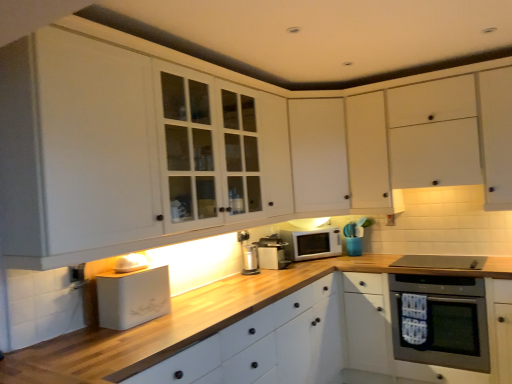
Question: From a real-world perspective, is satin silver toaster at center, which is the 1th appliance from back to front, positioned over white glossy microwave at center based on gravity?

Choices:
 (A) yes
 (B) no

Answer: (B)

Question: From the image's perspective, is satin silver toaster at center, the first appliance in the right-to-left sequence, above white glossy microwave at center?

Choices:
 (A) yes
 (B) no

Answer: (B)

Question: From a real-world perspective, is satin silver toaster at center, the first appliance in the right-to-left sequence, under white glossy microwave at center?

Choices:
 (A) yes
 (B) no

Answer: (A)

Question: Is satin silver toaster at center, the 3th appliance when ordered from left to right, surrounding white glossy microwave at center?

Choices:
 (A) yes
 (B) no

Answer: (B)

Question: Does satin silver toaster at center, the first appliance in the right-to-left sequence, have a larger size compared to white glossy microwave at center?

Choices:
 (A) no
 (B) yes

Answer: (A)

Question: Based on their sizes in the image, would you say white matte cabinet at upper center, the 1th cabinetry viewed from the back, is bigger or smaller than white matte drawer at lower center?

Choices:
 (A) small
 (B) big

Answer: (A)

Question: Considering the positions of white matte cabinet at upper center, the third cabinetry in the front-to-back sequence, and white matte drawer at lower center in the image, is white matte cabinet at upper center, the third cabinetry in the front-to-back sequence, wider or thinner than white matte drawer at lower center?

Choices:
 (A) thin
 (B) wide

Answer: (A)

Question: In the image, is white matte cabinet at upper center, the third cabinetry in the front-to-back sequence, positioned in front of or behind white matte drawer at lower center?

Choices:
 (A) front
 (B) behind

Answer: (B)

Question: In the image, is white matte cabinet at upper center, the 1th cabinetry viewed from the back, on the left side or the right side of white matte drawer at lower center?

Choices:
 (A) right
 (B) left

Answer: (A)

Question: In terms of size, does white matte bread bin at lower left, the third appliance from the right, appear bigger or smaller than matte gray oven at lower right?

Choices:
 (A) small
 (B) big

Answer: (B)

Question: Relative to matte gray oven at lower right, is white matte bread bin at lower left, the first appliance from the left, in front or behind?

Choices:
 (A) behind
 (B) front

Answer: (B)

Question: Is white matte bread bin at lower left, the third appliance viewed from the back, wider or thinner than matte gray oven at lower right?

Choices:
 (A) wide
 (B) thin

Answer: (B)

Question: From a real-world perspective, is white matte bread bin at lower left, the third appliance from the right, above or below matte gray oven at lower right?

Choices:
 (A) below
 (B) above

Answer: (B)

Question: In terms of size, does white glossy microwave at center appear bigger or smaller than white matte drawer at lower center?

Choices:
 (A) small
 (B) big

Answer: (A)

Question: From a real-world perspective, relative to white matte drawer at lower center, is white glossy microwave at center vertically above or below?

Choices:
 (A) below
 (B) above

Answer: (B)